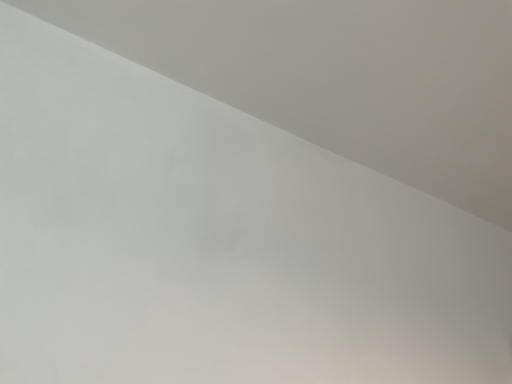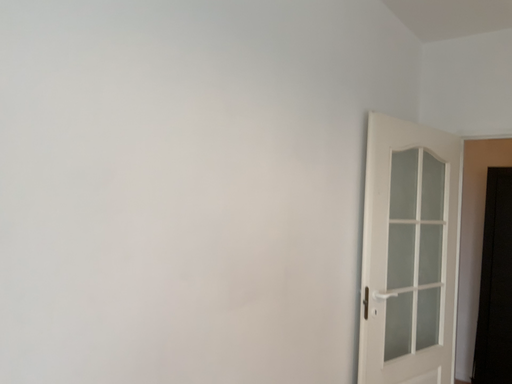
Question: Which way did the camera rotate in the video?

Choices:
 (A) rotated left
 (B) rotated right

Answer: (B)